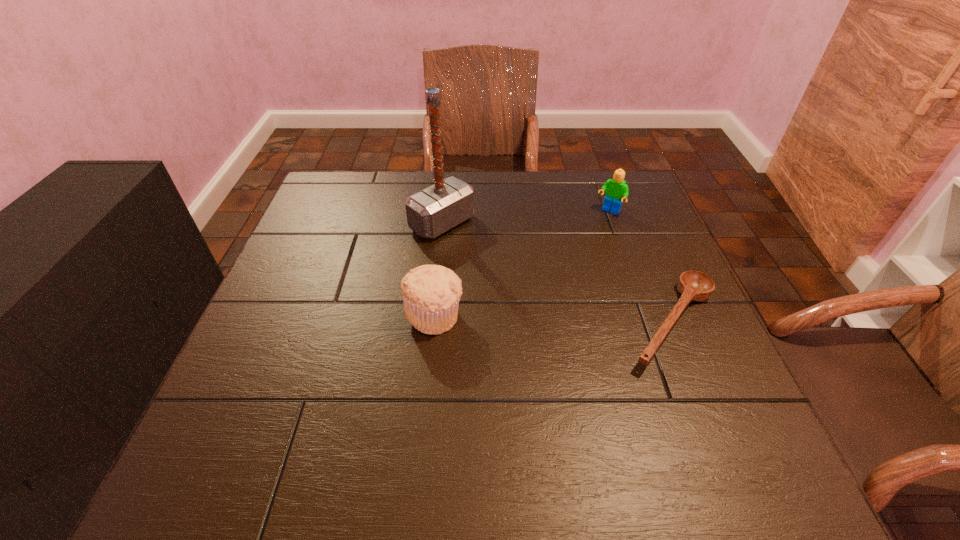
Where is `vacant space at the right edge of the desktop`? vacant space at the right edge of the desktop is located at coordinates (674, 362).

Where is `free space at the far right corner of the desktop`? The height and width of the screenshot is (540, 960). free space at the far right corner of the desktop is located at coordinates (599, 182).

Locate an element on the screen. This screenshot has width=960, height=540. vacant space at the near right corner of the desktop is located at coordinates click(696, 399).

The width and height of the screenshot is (960, 540). What are the coordinates of `blank region between the Lego and the wooden spoon` in the screenshot? It's located at (641, 267).

Locate an element on the screen. empty location between the Lego and the muffin is located at coordinates (521, 264).

The image size is (960, 540). What are the coordinates of `vacant space that is in between the wooden spoon and the Lego` in the screenshot? It's located at (641, 267).

Image resolution: width=960 pixels, height=540 pixels. Identify the location of empty space that is in between the Lego and the hammer. (525, 218).

Identify the location of unoccupied area between the Lego and the tallest object. Image resolution: width=960 pixels, height=540 pixels. (525, 218).

This screenshot has height=540, width=960. Find the location of `empty space that is in between the wooden spoon and the Lego`. empty space that is in between the wooden spoon and the Lego is located at coordinates (641, 267).

At what (x,y) coordinates should I click in order to perform the action: click on free space between the wooden spoon and the muffin. Please return your answer as a coordinate pair (x, y). This screenshot has height=540, width=960. Looking at the image, I should click on [554, 319].